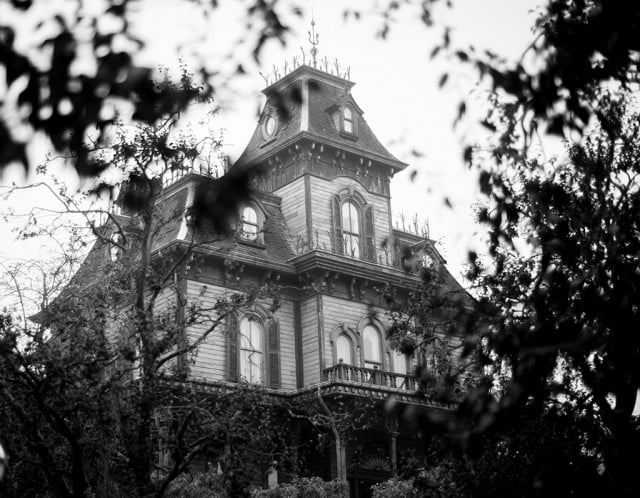
Find the location of `attic`. attic is located at coordinates [326, 133].